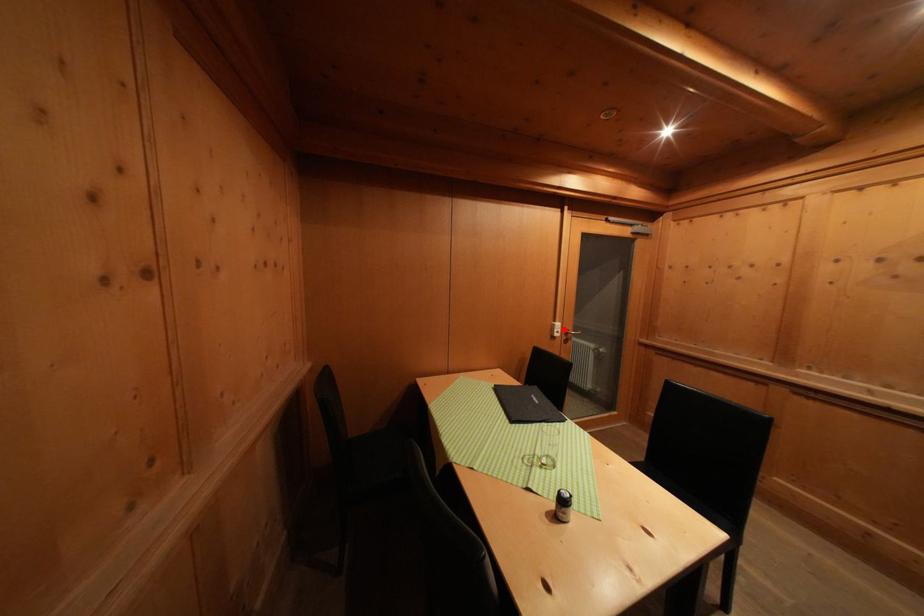
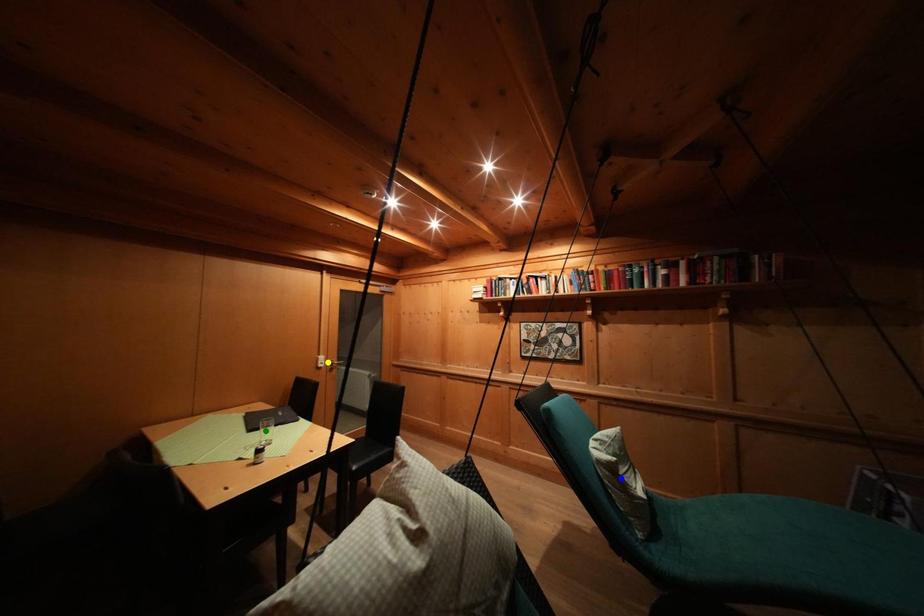
Question: I am providing you with two images of the same scene from different viewpoints. A red point is marked on the first image. You are given multiple points on the second image. Which point in image 2 is actually the same real-world point as the red point in image 1?

Choices:
 (A) yellow point
 (B) blue point
 (C) green point

Answer: (A)